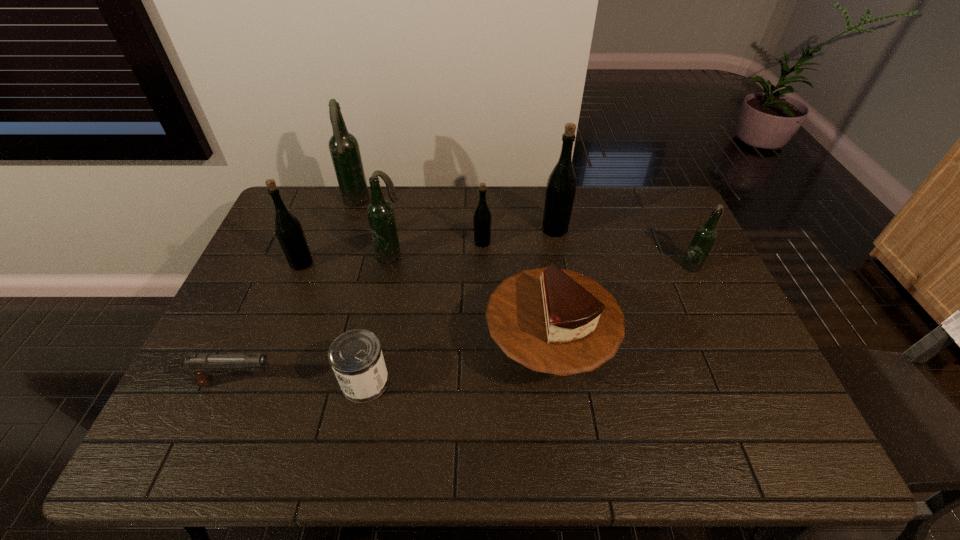
Locate an element on the screen. free space between the can and the fourth beer bottle from left to right is located at coordinates (423, 312).

The image size is (960, 540). Find the location of `unoccupied area between the can and the fourth beer bottle from left to right`. unoccupied area between the can and the fourth beer bottle from left to right is located at coordinates (423, 312).

Find the location of a particular element. The image size is (960, 540). free space between the can and the second smallest dark beer bottle is located at coordinates (378, 318).

The image size is (960, 540). What are the coordinates of `free spot between the second biggest dark beer bottle and the third beer bottle from right to left` in the screenshot? It's located at (437, 248).

Locate an element on the screen. free area in between the farthest object and the cake is located at coordinates (452, 274).

In order to click on free spot between the red cake and the can in this screenshot , I will do `click(457, 364)`.

This screenshot has width=960, height=540. I want to click on vacant point located between the gray gun and the second biggest green beer bottle, so click(270, 323).

At what (x,y) coordinates should I click in order to perform the action: click on empty space that is in between the gun and the leftmost dark beer bottle. Please return your answer as a coordinate pair (x, y). Looking at the image, I should click on (297, 293).

What are the coordinates of `empty space that is in between the gun and the farthest object` in the screenshot? It's located at (297, 293).

Locate an element on the screen. The width and height of the screenshot is (960, 540). object that stands as the eighth closest to the farthest dark beer bottle is located at coordinates (705, 236).